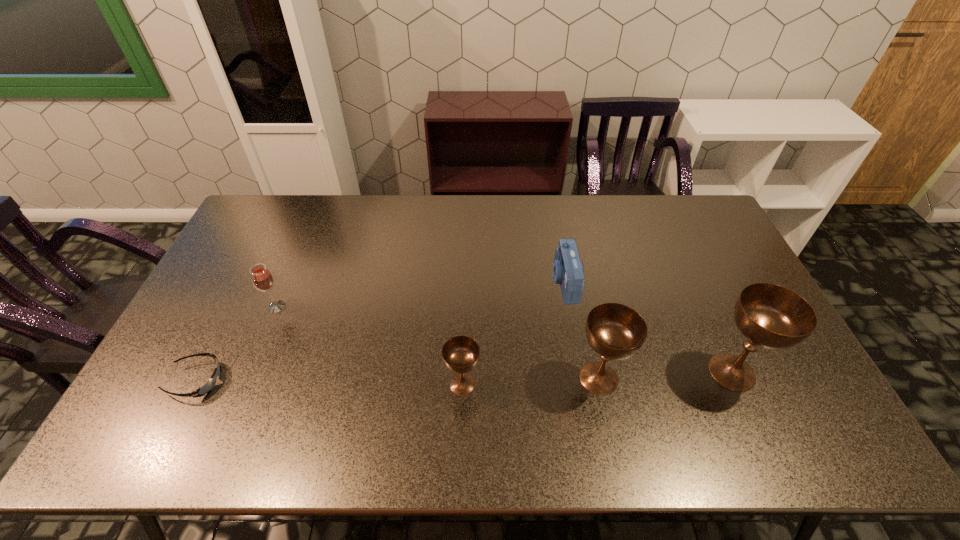
The width and height of the screenshot is (960, 540). Find the location of `blank area located 0.130m on the left of the fifth shortest object`. blank area located 0.130m on the left of the fifth shortest object is located at coordinates (523, 378).

At what (x,y) coordinates should I click in order to perform the action: click on vacant space located 0.180m on the left of the rightmost object. Please return your answer as a coordinate pair (x, y). Looking at the image, I should click on (635, 372).

You are a GUI agent. You are given a task and a screenshot of the screen. Output one action in this format:
    pyautogui.click(x=<x>, y=<y>)
    Task: Click on the free space located 0.260m on the back of the wineglass
    The image size is (960, 540).
    Given the screenshot: What is the action you would take?
    pyautogui.click(x=303, y=243)

Locate an element on the screen. This screenshot has width=960, height=540. vacant space located 0.380m on the lens of the camera is located at coordinates (433, 282).

Identify the location of vacant point located 0.200m on the lens of the camera. This screenshot has height=540, width=960. (490, 282).

Where is `free region located on the lens of the camera`? This screenshot has height=540, width=960. free region located on the lens of the camera is located at coordinates (468, 282).

At what (x,y) coordinates should I click in order to perform the action: click on vacant space located 0.310m on the lenses of the leftmost object. Please return your answer as a coordinate pair (x, y). Looking at the image, I should click on (340, 380).

Locate an element on the screen. sunglasses at the near edge is located at coordinates (207, 387).

Identify the location of object at the left edge. The image size is (960, 540). (207, 387).

What are the coordinates of `object that is at the right edge` in the screenshot? It's located at (771, 316).